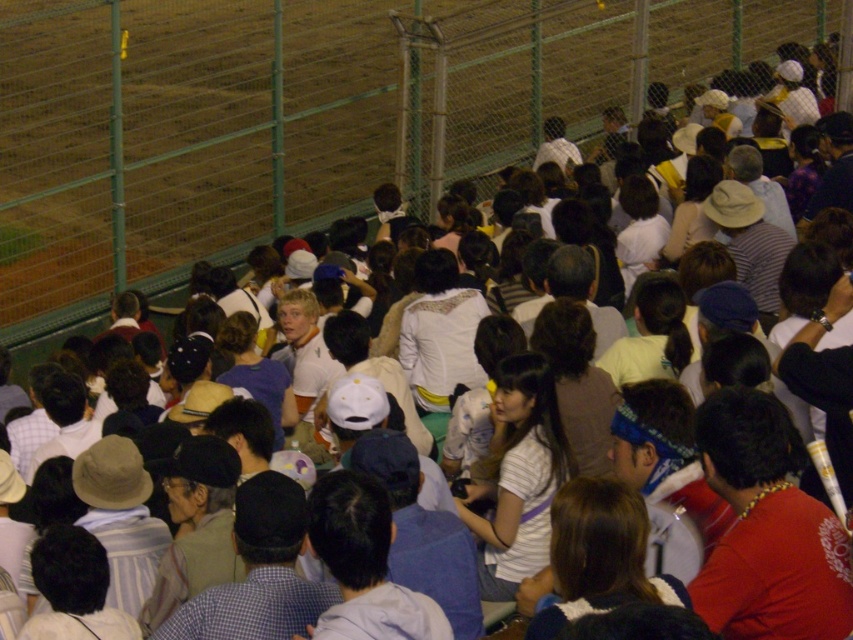
Question: Is the position of white striped shirt at center more distant than that of dark blue fabric at center?

Choices:
 (A) no
 (B) yes

Answer: (B)

Question: Considering the relative positions of white striped shirt at center and matte gray hat at center in the image provided, where is white striped shirt at center located with respect to matte gray hat at center?

Choices:
 (A) above
 (B) below

Answer: (A)

Question: Does red fabric shirt at center have a lesser width compared to white striped shirt at center?

Choices:
 (A) no
 (B) yes

Answer: (A)

Question: Which object appears farthest from the camera in this image?

Choices:
 (A) red fabric shirt at center
 (B) dark blue fabric at center
 (C) white striped shirt at center
 (D) matte gray hat at center

Answer: (C)

Question: Which object is positioned farthest from the white striped shirt at center?

Choices:
 (A) red fabric shirt at center
 (B) matte gray hat at center
 (C) dark blue fabric at center

Answer: (A)

Question: Which point is farther to the camera?

Choices:
 (A) (773, 481)
 (B) (550, 496)
 (C) (285, 577)

Answer: (B)